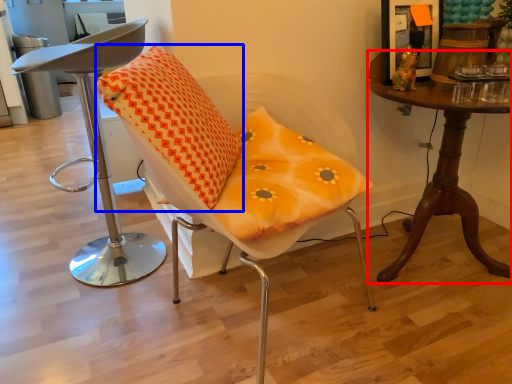
Question: Which of the following is the farthest to the observer, table (highlighted by a red box) or pillow (highlighted by a blue box)?

Choices:
 (A) table
 (B) pillow

Answer: (A)